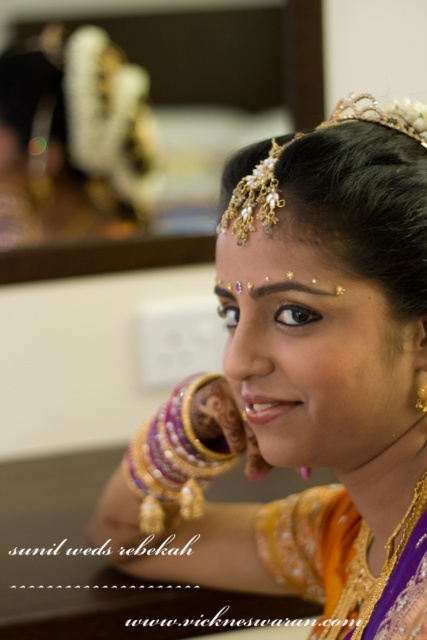
Question: Does goldmetallicbracelet at center have a smaller size compared to gold textured tiara at upper center?

Choices:
 (A) no
 (B) yes

Answer: (A)

Question: Which object is the closest to the purple/golden bangle at upper center?

Choices:
 (A) goldmetallicbracelet at center
 (B) gold textured tiara at upper center

Answer: (A)

Question: Which is farther from the goldmetallicbracelet at center?

Choices:
 (A) gold textured tiara at upper center
 (B) purple/golden bangle at upper center

Answer: (A)

Question: Can you confirm if goldmetallicbracelet at center is positioned to the left of purple/golden bangle at upper center?

Choices:
 (A) no
 (B) yes

Answer: (A)

Question: Observing the image, what is the correct spatial positioning of goldmetallicbracelet at center in reference to gold textured tiara at upper center?

Choices:
 (A) below
 (B) above

Answer: (A)

Question: Which of the following is the closest to the observer?

Choices:
 (A) (132, 452)
 (B) (260, 195)

Answer: (B)